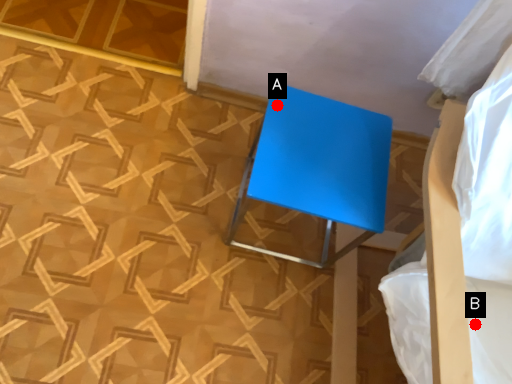
Question: Two points are circled on the image, labeled by A and B beside each circle. Which point is closer to the camera?

Choices:
 (A) A is closer
 (B) B is closer

Answer: (B)